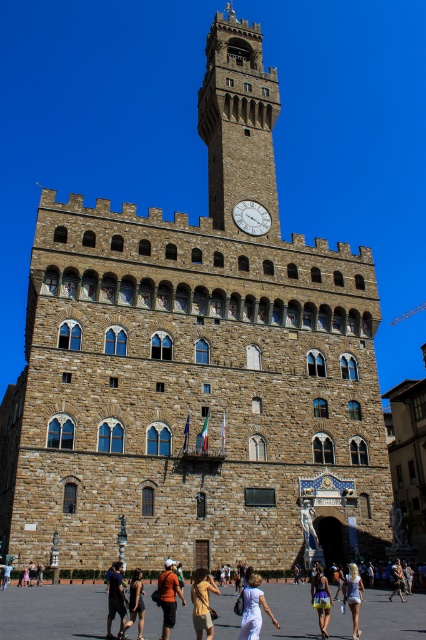
From the picture: You are a photographer trying to capture a photo of the dark blue shirt at center and the yellow and purple skirt at center. If you want to ensure both are fully visible in the frame, which object should you adjust your focus on to account for their sizes?

The dark blue shirt at center might be wider than the yellow and purple skirt at center, so you should focus on the dark blue shirt at center to ensure it fits within the frame.

You are a visitor standing in front of the grand historical building. You notice two items at the center of the scene. What is the position of the dark blue shirt at center relative to the yellow and purple skirt at center?

The dark blue shirt at center is positioned over the yellow and purple skirt at center.